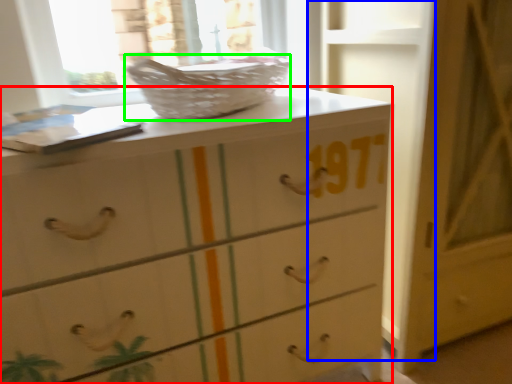
Question: Considering the real-world distances, which object is closest to chest of drawers (highlighted by a red box)? door (highlighted by a blue box) or basket (highlighted by a green box).

Choices:
 (A) door
 (B) basket

Answer: (B)